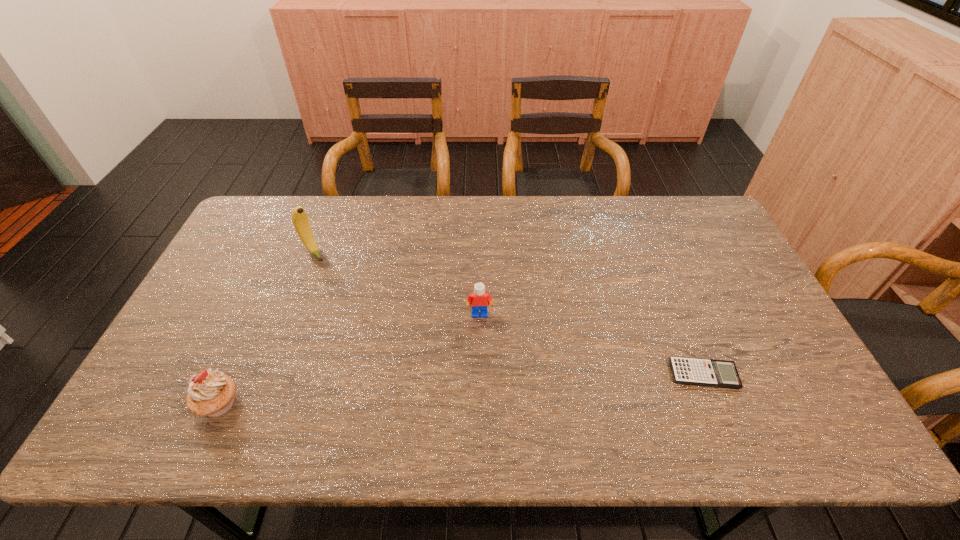
Find the location of a particular element. The height and width of the screenshot is (540, 960). unoccupied position between the second object from right to left and the cupcake is located at coordinates (349, 359).

At what (x,y) coordinates should I click in order to perform the action: click on unoccupied position between the cupcake and the rightmost object. Please return your answer as a coordinate pair (x, y). Looking at the image, I should click on (462, 389).

The height and width of the screenshot is (540, 960). I want to click on free space between the tallest object and the calculator, so click(x=509, y=313).

You are a GUI agent. You are given a task and a screenshot of the screen. Output one action in this format:
    pyautogui.click(x=<x>, y=<y>)
    Task: Click on the third closest object to the Lego
    The width and height of the screenshot is (960, 540).
    Given the screenshot: What is the action you would take?
    pyautogui.click(x=211, y=393)

Select which object appears as the second closest to the shortest object. Please provide its 2D coordinates. Your answer should be formatted as a tuple, i.e. [(x, y)], where the tuple contains the x and y coordinates of a point satisfying the conditions above.

[(300, 219)]

Locate an element on the screen. The width and height of the screenshot is (960, 540). vacant position in the image that satisfies the following two spatial constraints: 1. on the back side of the farthest object; 2. on the right side of the cupcake is located at coordinates (287, 252).